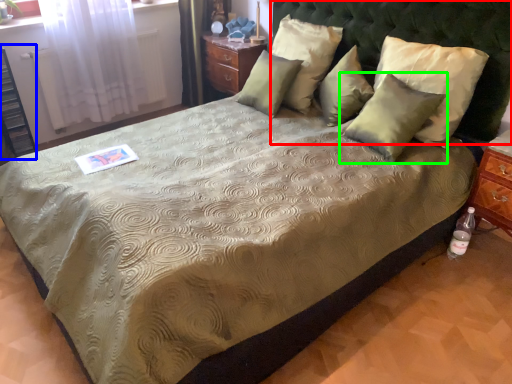
Question: Considering the real-world distances, which object is closest to headboard (highlighted by a red box)? dresser (highlighted by a blue box) or pillow (highlighted by a green box).

Choices:
 (A) dresser
 (B) pillow

Answer: (B)